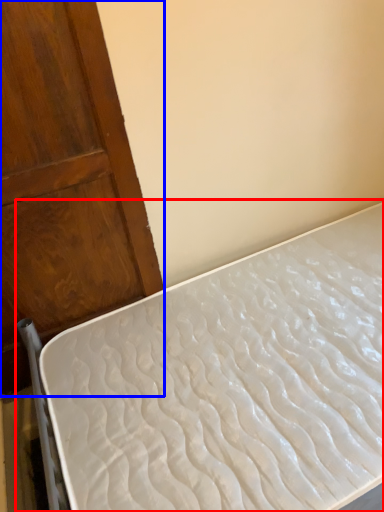
Question: Which of the following is the farthest to the observer, bed (highlighted by a red box) or door (highlighted by a blue box)?

Choices:
 (A) bed
 (B) door

Answer: (B)